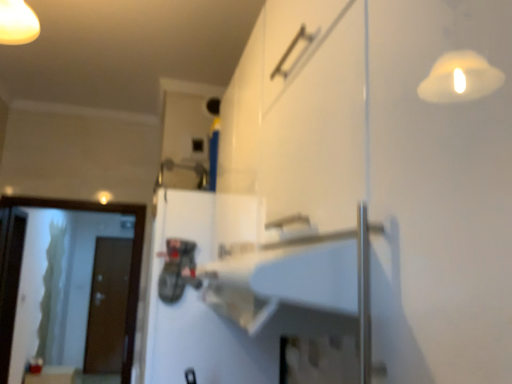
Describe the element at coordinates (9, 280) in the screenshot. This screenshot has width=512, height=384. I see `transparent glass screen door at left, which is counted as the first screen door, starting from the left` at that location.

In order to face white glossy screen door at left, which appears as the 1th screen door when viewed from the right, should I rotate leftwards or rightwards?

A 24.364 degree turn to the left will do.

At what (x,y) coordinates should I click in order to perform the action: click on white glossy screen door at left, placed as the second screen door when sorted from back to front. Please return your answer as a coordinate pair (x, y). Looking at the image, I should click on (68, 285).

Locate an element on the screen. The width and height of the screenshot is (512, 384). brown matte door at left, which ranks as the first door in back-to-front order is located at coordinates (108, 307).

From the image's perspective, which is above, white glossy screen door at left, placed as the second screen door when sorted from back to front, or white matte door at center, which ranks as the second door in bottom-to-top order?

white matte door at center, which ranks as the second door in bottom-to-top order, appears higher in the image.

Is white glossy screen door at left, the first screen door in the front-to-back sequence, not near white matte door at center, which ranks as the second door in bottom-to-top order?

Yes, white glossy screen door at left, the first screen door in the front-to-back sequence, and white matte door at center, which ranks as the second door in bottom-to-top order, are quite far apart.

Between white glossy screen door at left, the 2th screen door in the left-to-right sequence, and white matte door at center, the 2th door from the left, which one has more height?

With more height is white glossy screen door at left, the 2th screen door in the left-to-right sequence.

How far apart are white glossy screen door at left, placed as the second screen door when sorted from back to front, and white matte door at center, which ranks as the second door in bottom-to-top order?

white glossy screen door at left, placed as the second screen door when sorted from back to front, is 2.33 meters away from white matte door at center, which ranks as the second door in bottom-to-top order.

At what (x,y) coordinates should I click in order to perform the action: click on door below the transparent glass screen door at left, the 1th screen door positioned from the back (from the image's perspective). Please return your answer as a coordinate pair (x, y). Image resolution: width=512 pixels, height=384 pixels. Looking at the image, I should click on (108, 307).

Which is in front, point (103, 352) or point (11, 222)?

The point (11, 222) is more forward.

Considering the sizes of brown matte door at left, which is counted as the second door, starting from the right, and transparent glass screen door at left, which is counted as the first screen door, starting from the left, in the image, is brown matte door at left, which is counted as the second door, starting from the right, wider or thinner than transparent glass screen door at left, which is counted as the first screen door, starting from the left,?

brown matte door at left, which is counted as the second door, starting from the right, is thinner than transparent glass screen door at left, which is counted as the first screen door, starting from the left.

Which of these two, brown matte door at left, the second door when ordered from top to bottom, or transparent glass screen door at left, which is counted as the first screen door, starting from the left, stands shorter?

transparent glass screen door at left, which is counted as the first screen door, starting from the left, is shorter.

Consider the image. Which is closer to the camera, (x=45, y=292) or (x=1, y=264)?

The point (x=1, y=264) is closer to the camera.

Considering the relative sizes of white glossy screen door at left, placed as the second screen door when sorted from back to front, and transparent glass screen door at left, the second screen door in the right-to-left sequence, in the image provided, is white glossy screen door at left, placed as the second screen door when sorted from back to front, taller than transparent glass screen door at left, the second screen door in the right-to-left sequence,?

No.

Can you confirm if white glossy screen door at left, which appears as the 1th screen door when viewed from the right, is positioned to the right of transparent glass screen door at left, acting as the 2th screen door starting from the front?

Yes, white glossy screen door at left, which appears as the 1th screen door when viewed from the right, is to the right of transparent glass screen door at left, acting as the 2th screen door starting from the front.

This screenshot has width=512, height=384. Identify the location of screen door that appears above the transparent glass screen door at left, which is counted as the first screen door, starting from the left (from a real-world perspective). (68, 285).

From the image's perspective, is brown matte door at left, which is counted as the second door, starting from the right, below white glossy screen door at left, which appears as the 1th screen door when viewed from the right?

Correct, brown matte door at left, which is counted as the second door, starting from the right, appears lower than white glossy screen door at left, which appears as the 1th screen door when viewed from the right, in the image.

In the image, is brown matte door at left, which ranks as the first door in left-to-right order, positioned in front of or behind white glossy screen door at left, which appears as the 1th screen door when viewed from the right?

Clearly, brown matte door at left, which ranks as the first door in left-to-right order, is behind white glossy screen door at left, which appears as the 1th screen door when viewed from the right.

The image size is (512, 384). I want to click on door directly beneath the white glossy screen door at left, the 2th screen door in the left-to-right sequence (from a real-world perspective), so click(108, 307).

Which is behind, point (116, 291) or point (93, 308)?

Positioned behind is point (116, 291).

Which of these two, transparent glass screen door at left, which is counted as the first screen door, starting from the left, or white glossy screen door at left, the 2th screen door in the left-to-right sequence, stands taller?

transparent glass screen door at left, which is counted as the first screen door, starting from the left, is taller.

Considering the relative sizes of transparent glass screen door at left, acting as the 2th screen door starting from the front, and white glossy screen door at left, the 2th screen door in the left-to-right sequence, in the image provided, is transparent glass screen door at left, acting as the 2th screen door starting from the front, thinner than white glossy screen door at left, the 2th screen door in the left-to-right sequence,?

No.

Is transparent glass screen door at left, which is counted as the first screen door, starting from the left, not close to white glossy screen door at left, the first screen door in the front-to-back sequence?

transparent glass screen door at left, which is counted as the first screen door, starting from the left, is positioned a significant distance from white glossy screen door at left, the first screen door in the front-to-back sequence.

Is transparent glass screen door at left, acting as the 2th screen door starting from the front, positioned in front of white glossy screen door at left, placed as the second screen door when sorted from back to front?

That is False.

From a real-world perspective, is white matte door at center, marked as the 1th door in a front-to-back arrangement, under white glossy screen door at left, placed as the second screen door when sorted from back to front?

No.

Considering the relative positions of white matte door at center, which ranks as the second door in bottom-to-top order, and white glossy screen door at left, the 2th screen door in the left-to-right sequence, in the image provided, is white matte door at center, which ranks as the second door in bottom-to-top order, in front of white glossy screen door at left, the 2th screen door in the left-to-right sequence,?

Yes, white matte door at center, which ranks as the second door in bottom-to-top order, is in front of white glossy screen door at left, the 2th screen door in the left-to-right sequence.

Is white matte door at center, which ranks as the 2th door in back-to-front order, spatially inside white glossy screen door at left, placed as the second screen door when sorted from back to front, or outside of it?

white matte door at center, which ranks as the 2th door in back-to-front order, exists outside the volume of white glossy screen door at left, placed as the second screen door when sorted from back to front.

Measure the distance between white matte door at center, which ranks as the second door in bottom-to-top order, and white glossy screen door at left, the 2th screen door in the left-to-right sequence.

white matte door at center, which ranks as the second door in bottom-to-top order, and white glossy screen door at left, the 2th screen door in the left-to-right sequence, are 2.33 meters apart from each other.

Considering the sizes of objects white matte door at center, which ranks as the second door in bottom-to-top order, and brown matte door at left, the first door when ordered from bottom to top, in the image provided, who is thinner, white matte door at center, which ranks as the second door in bottom-to-top order, or brown matte door at left, the first door when ordered from bottom to top,?

With smaller width is brown matte door at left, the first door when ordered from bottom to top.

From a real-world perspective, which is physically above, white matte door at center, the 2th door from the left, or brown matte door at left, the second door when ordered from top to bottom?

In real-world perspective, white matte door at center, the 2th door from the left, is above.

Does white matte door at center, marked as the 1th door in a front-to-back arrangement, touch brown matte door at left, the first door when ordered from bottom to top?

No, white matte door at center, marked as the 1th door in a front-to-back arrangement, is not with brown matte door at left, the first door when ordered from bottom to top.

How much distance is there between white matte door at center, marked as the 1th door in a front-to-back arrangement, and brown matte door at left, the second door positioned from the front?

white matte door at center, marked as the 1th door in a front-to-back arrangement, is 4.57 meters from brown matte door at left, the second door positioned from the front.

From the image's perspective, starting from the white matte door at center, which ranks as the first door in top-to-bottom order, which screen door is the 1st one below? Please provide its 2D coordinates.

[(68, 285)]

From a real-world perspective, which screen door is the 1st one above the brown matte door at left, which is counted as the second door, starting from the right? Please provide its 2D coordinates.

[(9, 280)]

Considering their positions, is white glossy screen door at left, the first screen door in the front-to-back sequence, positioned closer to transparent glass screen door at left, the second screen door in the right-to-left sequence, than white matte door at center, marked as the 1th door in a front-to-back arrangement?

The object closer to transparent glass screen door at left, the second screen door in the right-to-left sequence, is white glossy screen door at left, the first screen door in the front-to-back sequence.

Looking at the image, which one is located further to brown matte door at left, the first door when ordered from bottom to top, transparent glass screen door at left, which is counted as the first screen door, starting from the left, or white glossy screen door at left, which appears as the 1th screen door when viewed from the right?

The object further to brown matte door at left, the first door when ordered from bottom to top, is transparent glass screen door at left, which is counted as the first screen door, starting from the left.

In the scene shown: From the image, which object appears to be nearer to white glossy screen door at left, placed as the second screen door when sorted from back to front, white matte door at center, which ranks as the second door in bottom-to-top order, or transparent glass screen door at left, acting as the 2th screen door starting from the front?

Among the two, transparent glass screen door at left, acting as the 2th screen door starting from the front, is located nearer to white glossy screen door at left, placed as the second screen door when sorted from back to front.

Based on their spatial positions, is transparent glass screen door at left, the 1th screen door positioned from the back, or brown matte door at left, the first door when ordered from bottom to top, closer to white matte door at center, which ranks as the second door in bottom-to-top order?

Among the two, transparent glass screen door at left, the 1th screen door positioned from the back, is located nearer to white matte door at center, which ranks as the second door in bottom-to-top order.

Which object lies further to the anchor point transparent glass screen door at left, the second screen door in the right-to-left sequence, brown matte door at left, the second door when ordered from top to bottom, or white glossy screen door at left, placed as the second screen door when sorted from back to front?

brown matte door at left, the second door when ordered from top to bottom, is further to transparent glass screen door at left, the second screen door in the right-to-left sequence.

Which object lies further to the anchor point white matte door at center, which is the 1th door from right to left, white glossy screen door at left, the first screen door in the front-to-back sequence, or brown matte door at left, the second door positioned from the front?

The object further to white matte door at center, which is the 1th door from right to left, is brown matte door at left, the second door positioned from the front.

Based on their spatial positions, is white glossy screen door at left, the first screen door in the front-to-back sequence, or transparent glass screen door at left, which is counted as the first screen door, starting from the left, closer to white matte door at center, which ranks as the 2th door in back-to-front order?

transparent glass screen door at left, which is counted as the first screen door, starting from the left, is positioned closer to the anchor white matte door at center, which ranks as the 2th door in back-to-front order.

Looking at this image, which object lies further to the anchor point brown matte door at left, which is counted as the second door, starting from the right, white matte door at center, marked as the 1th door in a front-to-back arrangement, or transparent glass screen door at left, the 1th screen door positioned from the back?

white matte door at center, marked as the 1th door in a front-to-back arrangement, lies further to brown matte door at left, which is counted as the second door, starting from the right, than the other object.

Where is `screen door situated between transparent glass screen door at left, acting as the 2th screen door starting from the front, and white matte door at center, which ranks as the 2th door in back-to-front order, from left to right`? screen door situated between transparent glass screen door at left, acting as the 2th screen door starting from the front, and white matte door at center, which ranks as the 2th door in back-to-front order, from left to right is located at coordinates (x=68, y=285).

Find the location of a particular element. The height and width of the screenshot is (384, 512). screen door between white glossy screen door at left, the first screen door in the front-to-back sequence, and brown matte door at left, which is counted as the second door, starting from the right, along the z-axis is located at coordinates (9, 280).